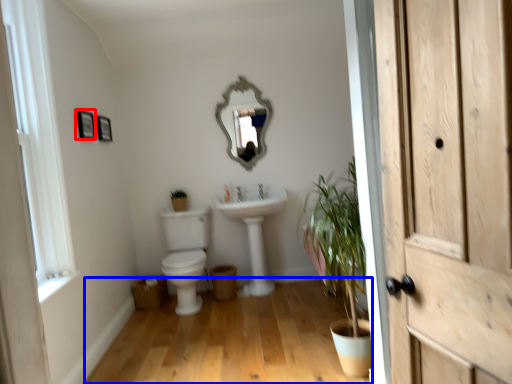
Question: Among these objects, which one is nearest to the camera, picture frame (highlighted by a red box) or plain (highlighted by a blue box)?

Choices:
 (A) picture frame
 (B) plain

Answer: (B)